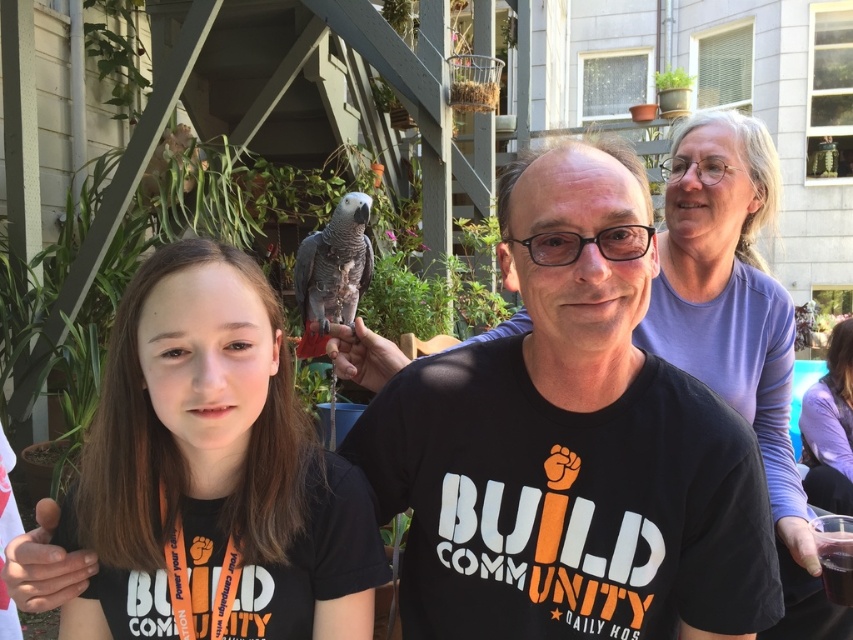
Question: From the image, what is the correct spatial relationship of matte black shirt at center in relation to purple cotton shirt at upper right?

Choices:
 (A) above
 (B) below

Answer: (A)

Question: Considering the real-world distances, which object is closest to the gray matte parrot at center?

Choices:
 (A) matte black shirt at center
 (B) translucent glass cup at lower right
 (C) purple cotton shirt at upper right
 (D) black matte shirt at center

Answer: (A)

Question: Among these objects, which one is farthest from the camera?

Choices:
 (A) translucent glass cup at lower right
 (B) matte black shirt at center

Answer: (A)

Question: Which point is farther to the camera?

Choices:
 (A) matte black shirt at center
 (B) gray matte parrot at center
 (C) purple cotton shirt at upper right
 (D) translucent glass cup at lower right

Answer: (C)

Question: Does black matte shirt at center appear under matte black shirt at center?

Choices:
 (A) no
 (B) yes

Answer: (A)

Question: Does gray matte parrot at center appear under purple cotton shirt at upper right?

Choices:
 (A) yes
 (B) no

Answer: (B)